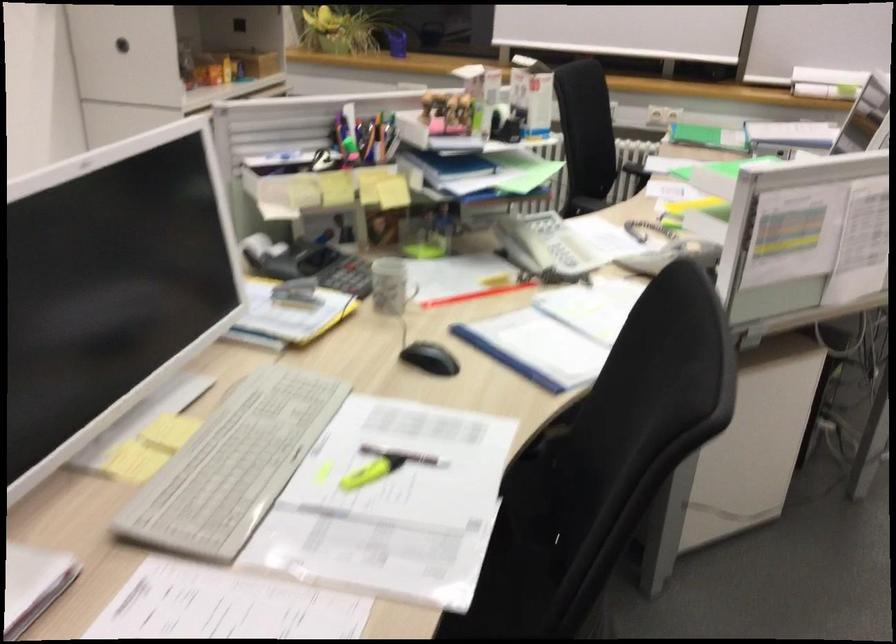
Find where to lift the white telephone handset. Please return your answer as a coordinate pair (x, y).

(522, 243)